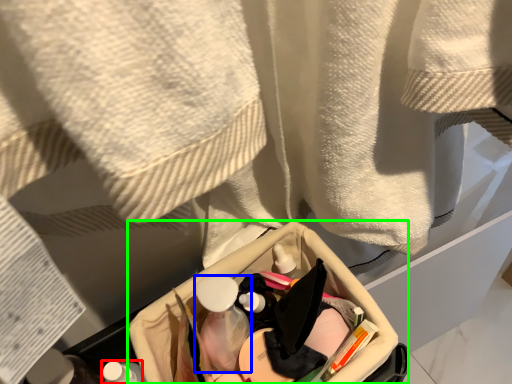
Question: Estimate the real-world distances between objects in this image. Which object is closer to toiletry (highlighted by a red box), mouthwash (highlighted by a blue box) or storage box (highlighted by a green box)?

Choices:
 (A) mouthwash
 (B) storage box

Answer: (A)